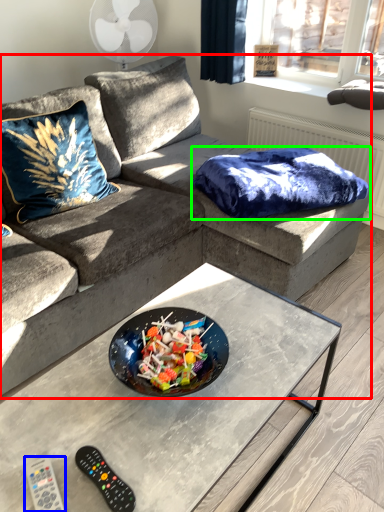
Question: Based on their relative distances, which object is farther from studio couch (highlighted by a red box)? Choose from remote (highlighted by a blue box) and blanket (highlighted by a green box).

Choices:
 (A) remote
 (B) blanket

Answer: (A)